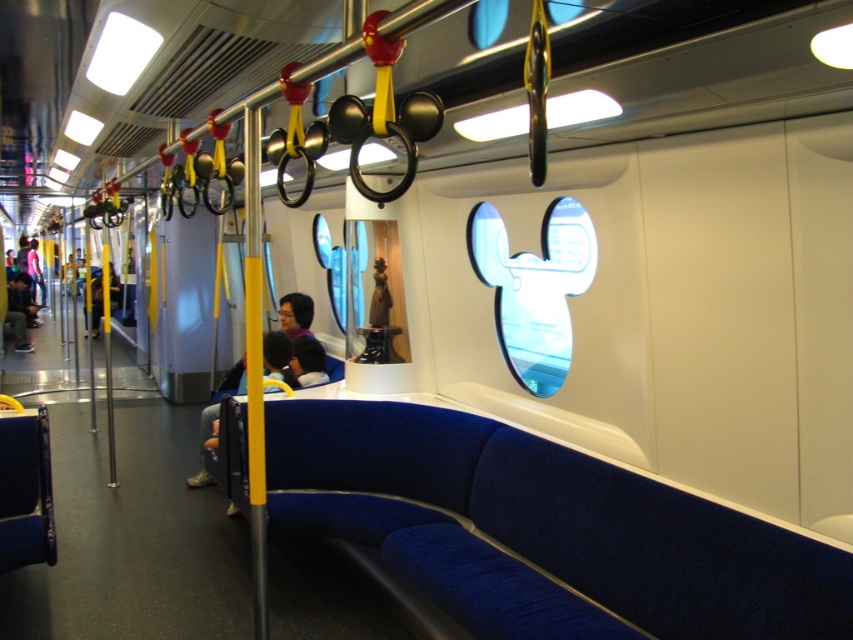
Question: Among these objects, which one is farthest from the camera?

Choices:
 (A) transparent plastic window at center
 (B) matte black jacket at left
 (C) blue fabric seat at center

Answer: (B)

Question: Which point is closer to the camera?

Choices:
 (A) transparent plastic window at center
 (B) matte blue pants at center
 (C) blue fabric seat at center
 (D) matte black jacket at left

Answer: (C)

Question: Can you confirm if blue fabric seat at center is smaller than matte black jacket at left?

Choices:
 (A) yes
 (B) no

Answer: (A)

Question: Can you confirm if transparent plastic window at center is positioned to the right of matte black jacket at left?

Choices:
 (A) yes
 (B) no

Answer: (A)

Question: Which point is farther to the camera?

Choices:
 (A) (16, 282)
 (B) (473, 596)

Answer: (A)

Question: Is blue fabric seat at center wider than matte blue pants at center?

Choices:
 (A) yes
 (B) no

Answer: (A)